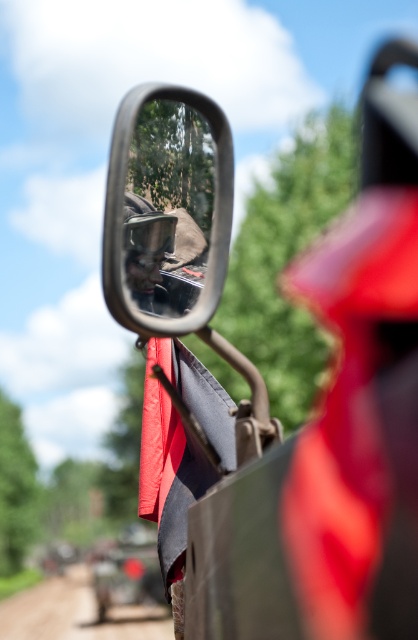
Does clear plastic mirror at center have a lesser width compared to dirt track at lower left?

Indeed, clear plastic mirror at center has a lesser width compared to dirt track at lower left.

Can you confirm if clear plastic mirror at center is taller than dirt track at lower left?

In fact, clear plastic mirror at center may be shorter than dirt track at lower left.

What are the coordinates of `clear plastic mirror at center` in the screenshot? It's located at (168, 205).

The width and height of the screenshot is (418, 640). I want to click on clear plastic mirror at center, so click(x=168, y=205).